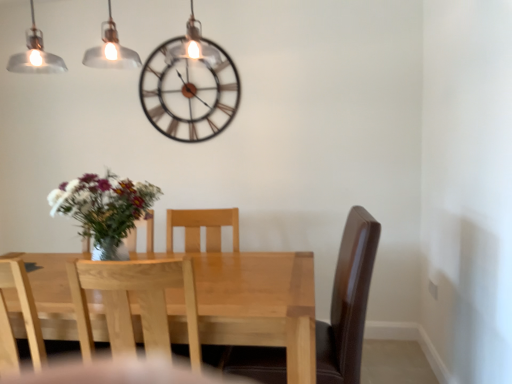
Question: Is light wood chair at left, the 2th chair positioned from the right, wider or thinner than metallic brown clock at upper center?

Choices:
 (A) thin
 (B) wide

Answer: (B)

Question: Is light wood chair at left, the 2th chair positioned from the right, inside or outside of metallic brown clock at upper center?

Choices:
 (A) outside
 (B) inside

Answer: (A)

Question: Which of these objects is positioned closest to the light wood chair at center, the second chair positioned from the left?

Choices:
 (A) light wood chair at left, the 2th chair positioned from the right
 (B) metallic brown clock at upper center
 (C) light wood table at center

Answer: (C)

Question: Estimate the real-world distances between objects in this image. Which object is closer to the light wood table at center?

Choices:
 (A) light wood chair at left, the 2th chair positioned from the right
 (B) metallic brown clock at upper center
 (C) light wood chair at center, the second chair positioned from the left

Answer: (C)